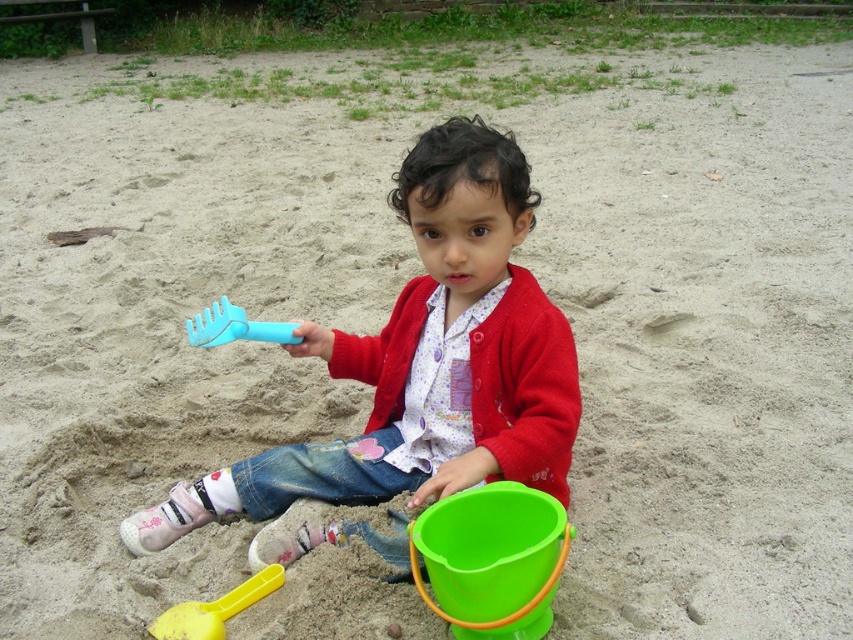
Question: Based on their relative distances, which object is nearer to the green plastic bucket at lower center?

Choices:
 (A) yellow plastic shovel at lower left
 (B) blue plastic rake at center

Answer: (A)

Question: Observing the image, what is the correct spatial positioning of matte plastic toddler at center in reference to green plastic bucket at lower center?

Choices:
 (A) right
 (B) left

Answer: (B)

Question: From the image, what is the correct spatial relationship of matte plastic toddler at center in relation to green plastic bucket at lower center?

Choices:
 (A) below
 (B) above

Answer: (B)

Question: Which object is the closest to the blue plastic rake at center?

Choices:
 (A) green plastic bucket at lower center
 (B) matte plastic toddler at center
 (C) yellow plastic shovel at lower left

Answer: (B)

Question: Which object is positioned farthest from the yellow plastic shovel at lower left?

Choices:
 (A) green plastic bucket at lower center
 (B) blue plastic rake at center
 (C) matte plastic toddler at center

Answer: (B)

Question: Observing the image, what is the correct spatial positioning of matte plastic toddler at center in reference to yellow plastic shovel at lower left?

Choices:
 (A) right
 (B) left

Answer: (A)